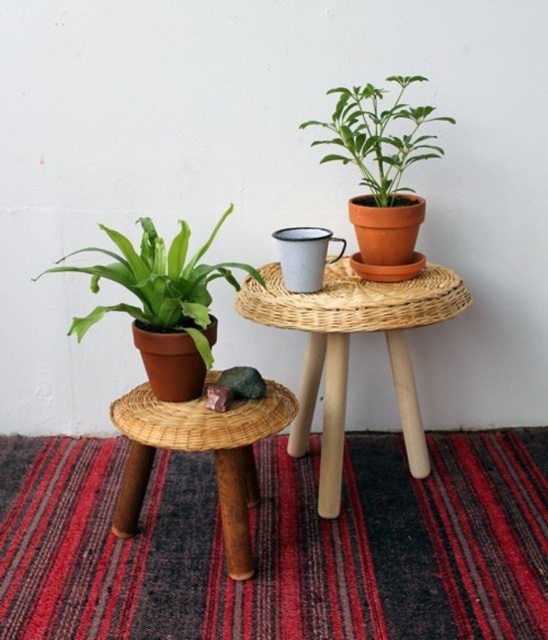
Question: Which point is closer to the camera?

Choices:
 (A) (456, 554)
 (B) (415, 132)
 (C) (231, 456)
 (D) (197, 282)

Answer: (C)

Question: Does rattan stool at lower left appear on the right side of green matte plant at upper right?

Choices:
 (A) no
 (B) yes

Answer: (A)

Question: Which object is the closest to the rattan stool at lower left?

Choices:
 (A) woven wood table at center
 (B) rug with woven texture at lower center
 (C) green matte plant at upper right

Answer: (B)

Question: Is rug with woven texture at lower center below woven wood table at center?

Choices:
 (A) yes
 (B) no

Answer: (A)

Question: Which object appears closest to the camera in this image?

Choices:
 (A) woven wood table at center
 (B) rattan stool at lower left
 (C) green matte plant at upper right

Answer: (B)

Question: Is rug with woven texture at lower center thinner than green matte plant at upper right?

Choices:
 (A) no
 (B) yes

Answer: (A)